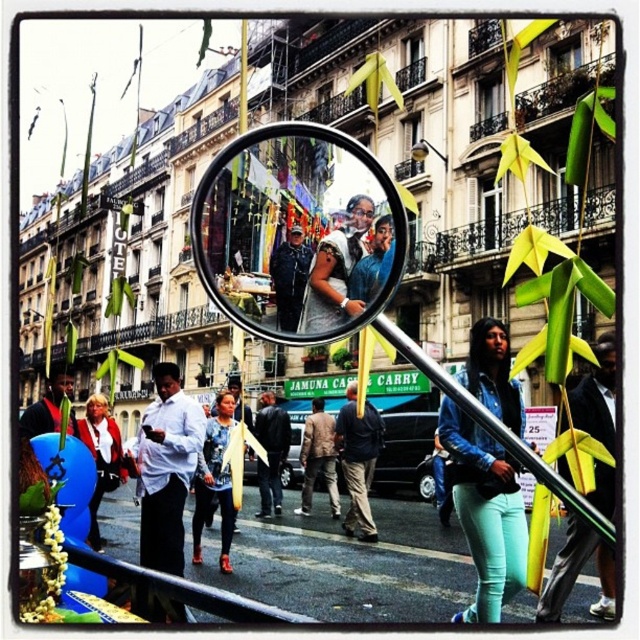
Question: Among these objects, which one is farthest from the camera?

Choices:
 (A) matte red jacket at lower left
 (B) transparent plastic magnifying glass at center
 (C) matte black jacket at center
 (D) white shirt at center

Answer: (C)

Question: Does matte black jacket at center lie in front of matte red jacket at lower left?

Choices:
 (A) yes
 (B) no

Answer: (B)

Question: Considering the real-world distances, which object is closest to the transparent plastic magnifying glass at center?

Choices:
 (A) white shirt at center
 (B) denim jacket at lower right
 (C) matte red jacket at lower left
 (D) matte black jacket at center

Answer: (B)

Question: Does denim jacket at lower right have a smaller size compared to matte red jacket at lower left?

Choices:
 (A) no
 (B) yes

Answer: (A)

Question: Which of these objects is positioned farthest from the denim jacket at lower right?

Choices:
 (A) matte red jacket at lower left
 (B) transparent plastic magnifying glass at center
 (C) white shirt at center
 (D) matte black jacket at center

Answer: (A)

Question: Where is transparent plastic magnifying glass at center located in relation to white shirt at center in the image?

Choices:
 (A) below
 (B) above

Answer: (B)